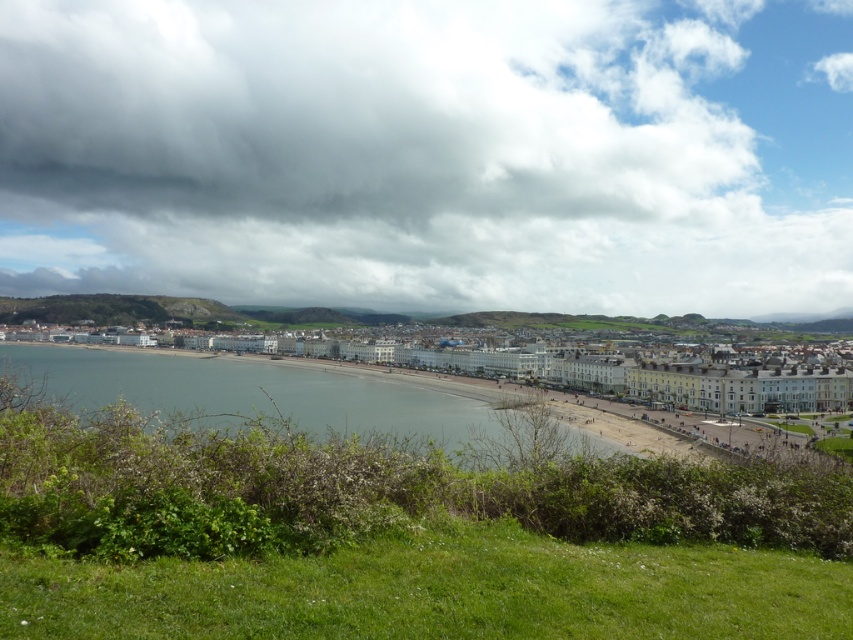
You are a drone operator planning to fly a drone from the cloudy sky at upper center to the white smooth buildings at center. What is the approximate distance the drone will travel?

The cloudy sky at upper center and white smooth buildings at center are 309.16 meters apart, so the drone will travel approximately 309.16 meters.

Looking at this image, you are standing on the beach and looking towards the horizon. Which object, the cloudy sky at upper center or the blue water at lower center, is positioned to the right when viewed from your perspective?

The cloudy sky at upper center is positioned to the right of the blue water at lower center.